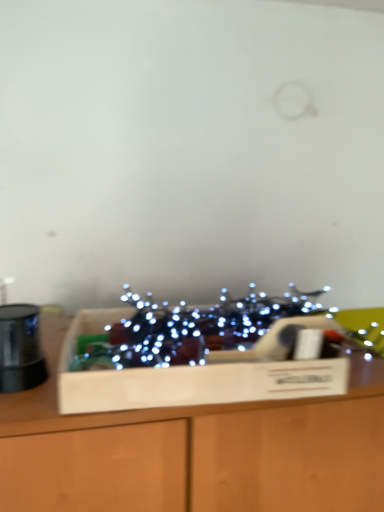
Question: Does point (120, 328) appear closer or farther from the camera than point (200, 439)?

Choices:
 (A) closer
 (B) farther

Answer: (B)

Question: Is illuminated string lights at center inside the boundaries of wooden box at center, or outside?

Choices:
 (A) inside
 (B) outside

Answer: (B)

Question: Based on their relative distances, which object is farther from the wooden box at center?

Choices:
 (A) illuminated string lights at center
 (B) wooden box at center

Answer: (A)

Question: Which of these objects is positioned farthest from the wooden box at center?

Choices:
 (A) illuminated string lights at center
 (B) wooden box at center

Answer: (A)